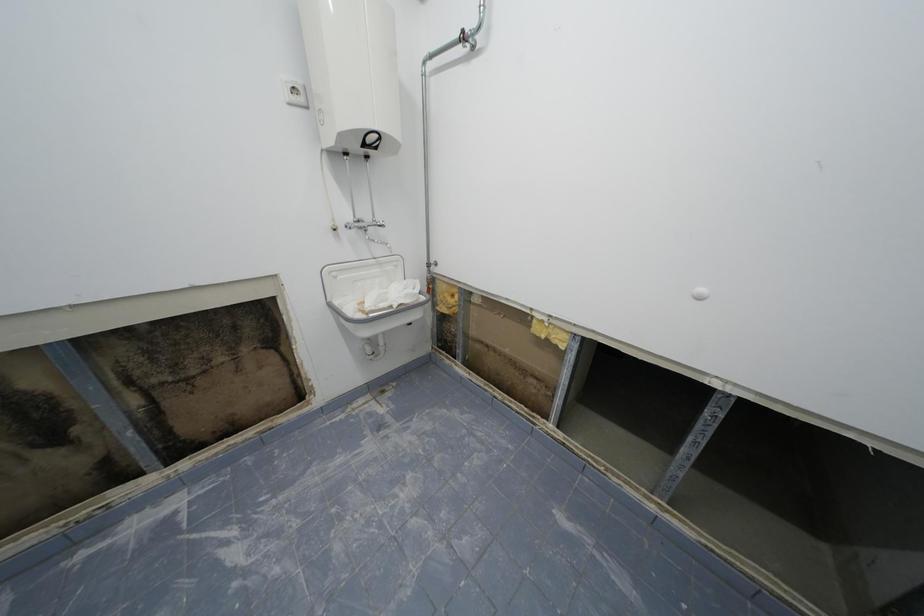
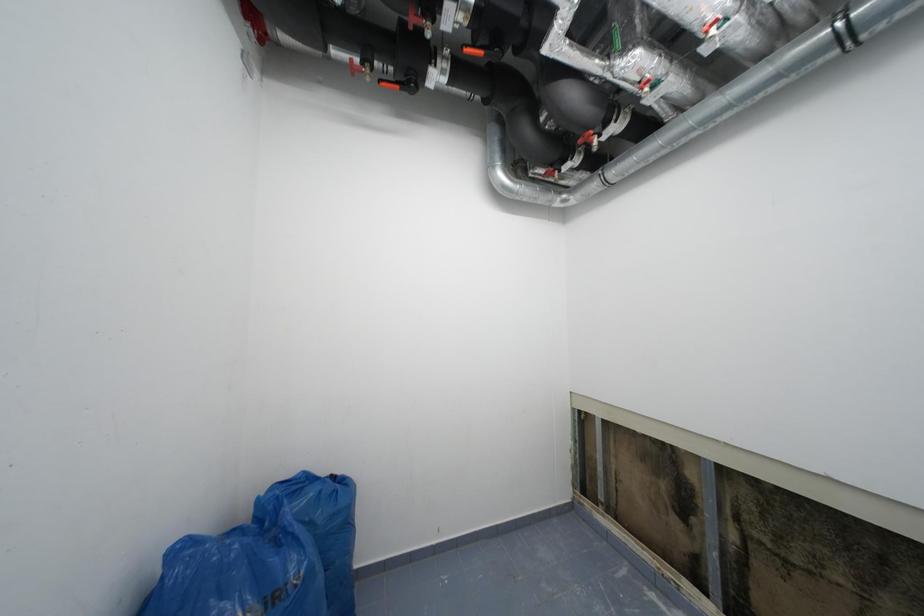
Question: The camera is either moving clockwise (left) or counter-clockwise (right) around the object. The first image is from the beginning of the video and the second image is from the end. Is the camera moving left or right when shooting the video?

Choices:
 (A) Left
 (B) Right

Answer: (B)